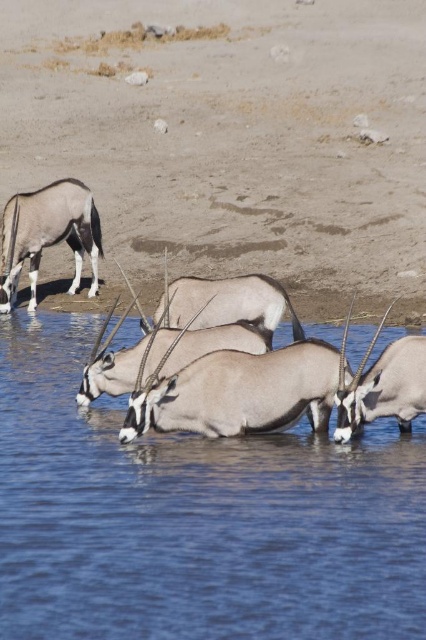
You are standing at the edge of the watering hole and want to reach the point marked at coordinates point (273, 509). Can you estimate how far you need to walk to get there?

The distance between you and point (273, 509) is 20.01 feet, so you need to walk approximately 20 feet to reach it.

You are a wildlife photographer aiming to capture a photo of the oryxes. You need to ensure that the smooth brown antelope at center and the shiny brown antelope at upper left are both in frame. Given that your camera has a fixed focal length, which oryx should you position closer to the center of the frame to ensure both are fully visible?

Since the smooth brown antelope at center is wider than the shiny brown antelope at upper left, positioning the smooth brown antelope at center closer to the center of the frame will help ensure both are fully visible within the camera frame.